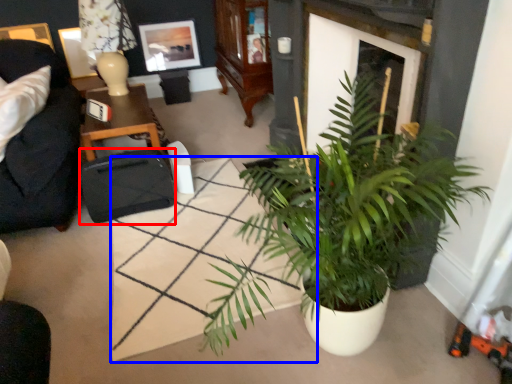
Question: Which point is closer to the camera, luggage and bags (highlighted by a red box) or square (highlighted by a blue box)?

Choices:
 (A) luggage and bags
 (B) square

Answer: (B)